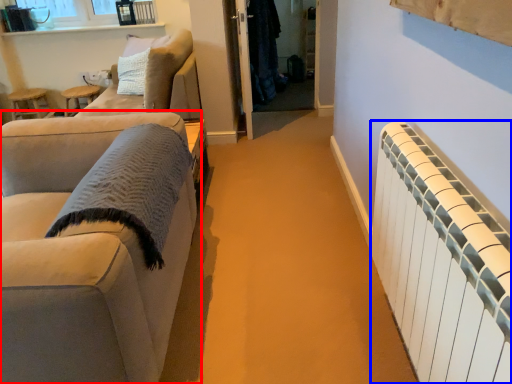
Question: Among these objects, which one is nearest to the camera, studio couch (highlighted by a red box) or radiator (highlighted by a blue box)?

Choices:
 (A) studio couch
 (B) radiator

Answer: (B)